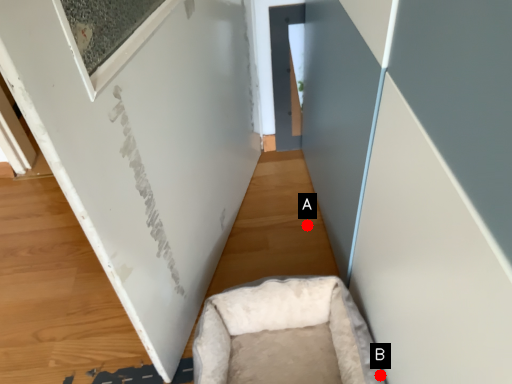
Question: Two points are circled on the image, labeled by A and B beside each circle. Which point is closer to the camera?

Choices:
 (A) A is closer
 (B) B is closer

Answer: (B)